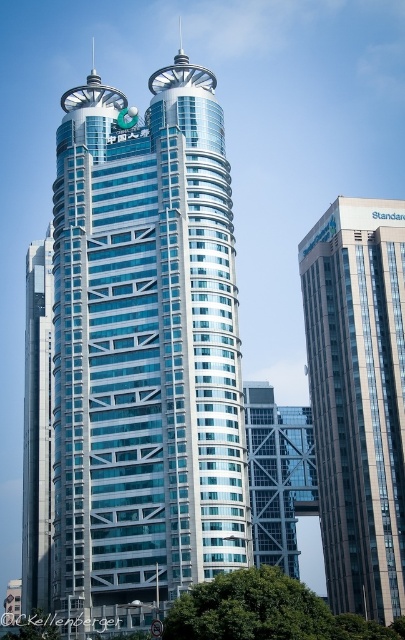
You are standing in front of the skyscraper and want to determine your position relative to two points marked on the building. The points are labeled as point 1 at coordinates point [59,596] and point 2 at coordinates point [44,577]. Which point is closer to you?

Point [59,596] is closer to the viewer than point [44,577].

You are a drone operator tasked with flying a drone from the top of the matte glass building at right to the nearest neighboring building. The drone has a maximum flight range of 80 meters. Can the drone successfully reach the nearest neighboring building without running out of battery?

The distance between the matte glass building at right and the nearest neighboring building is 78.21 meters. Since the drone has a maximum flight range of 80 meters, it can successfully reach the nearest neighboring building without running out of battery.

You are an urban planner analyzing the skyline. Given the glassy metallic skyscraper at center and the matte glass building at right, which one would require more reflective surface maintenance due to its size?

The glassy metallic skyscraper at center requires more reflective surface maintenance because it is bigger than the matte glass building at right, leading to a larger area needing upkeep.